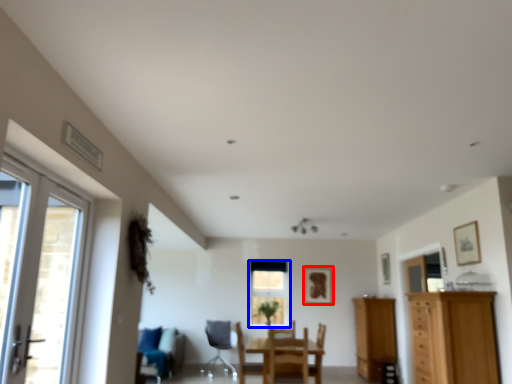
Question: Among these objects, which one is farthest to the camera, picture frame (highlighted by a red box) or window (highlighted by a blue box)?

Choices:
 (A) picture frame
 (B) window

Answer: (B)